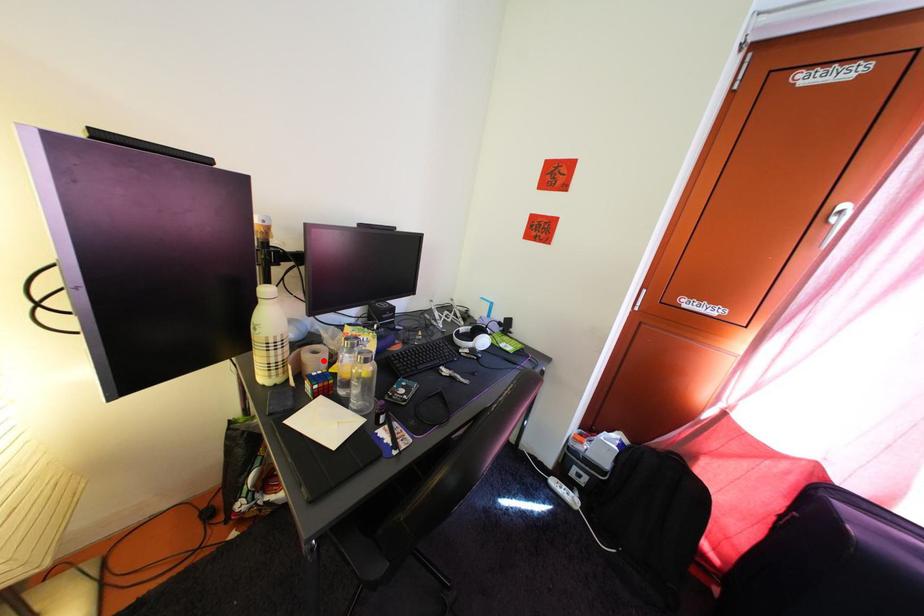
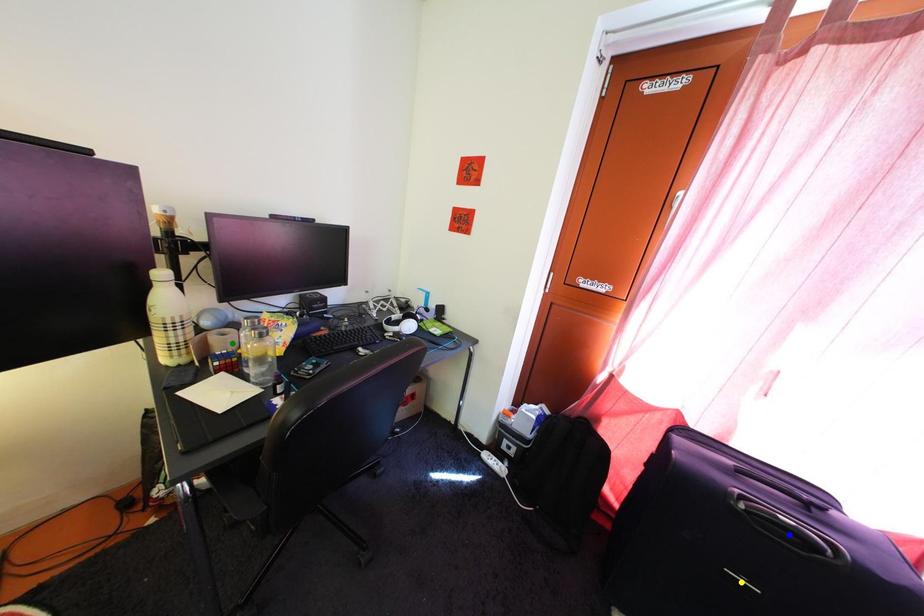
Question: I am providing you with two images of the same scene from different viewpoints. A red point is marked on the first image. You are given multiple points on the second image. Which point in image 2 represents the same 3d spot as the red point in image 1?

Choices:
 (A) blue point
 (B) green point
 (C) yellow point

Answer: (B)